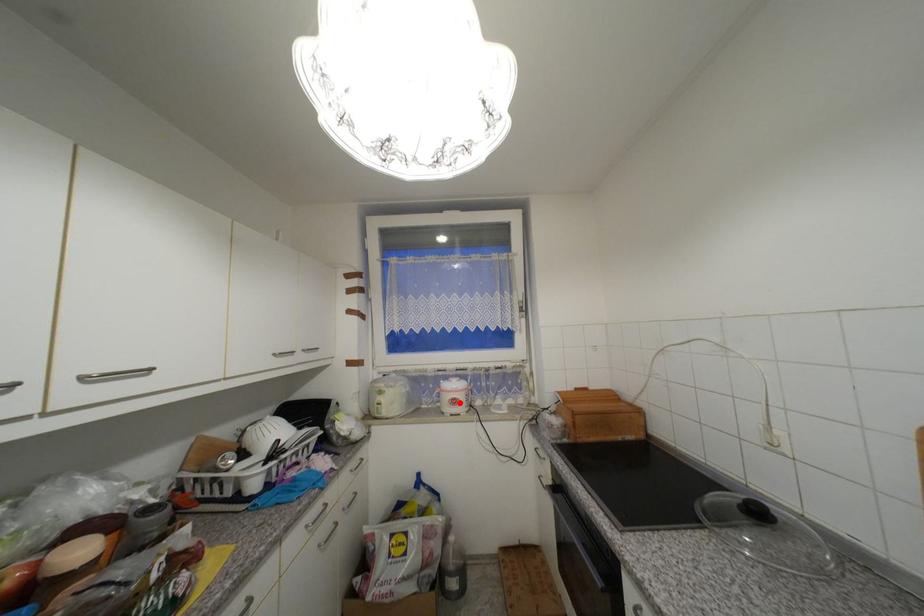
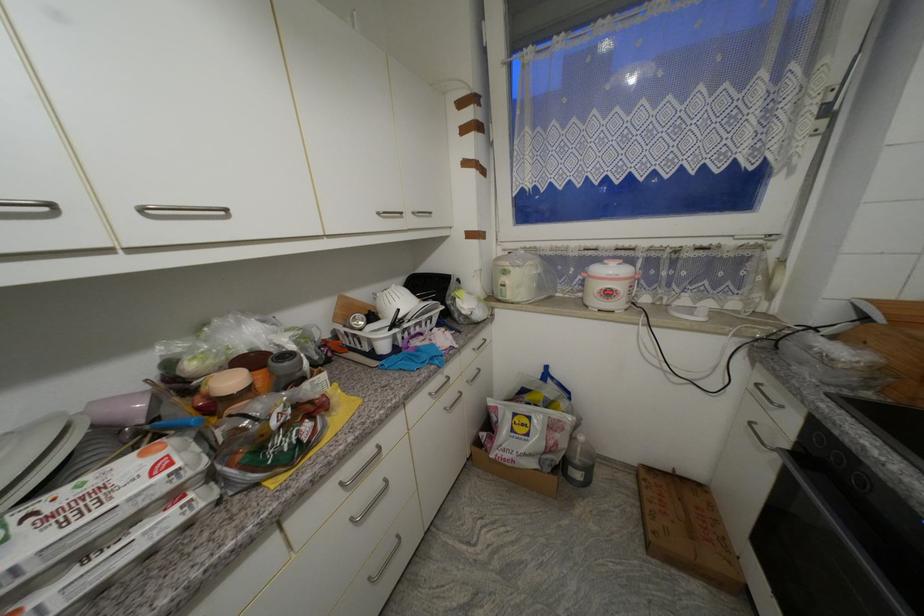
Locate, in the second image, the point that corresponds to the highlighted location in the first image.

(614, 294)